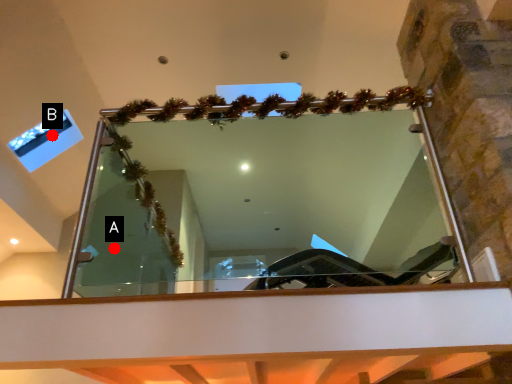
Question: Two points are circled on the image, labeled by A and B beside each circle. Which of the following is the farthest from the observer?

Choices:
 (A) A is further
 (B) B is further

Answer: (A)